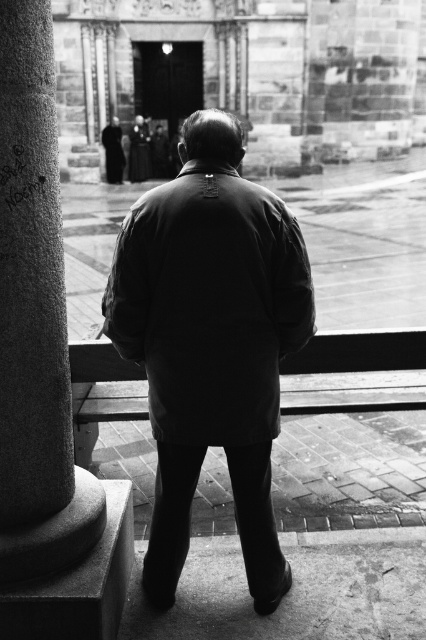
Can you confirm if granite column at left is taller than matte black jacket at center?

Yes.

At what (x,y) coordinates should I click in order to perform the action: click on granite column at left. Please return your answer as a coordinate pair (x, y). Image resolution: width=426 pixels, height=640 pixels. Looking at the image, I should click on (45, 378).